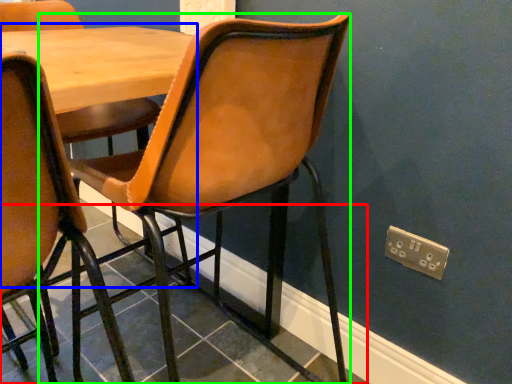
Question: Which object is positioned closest to tile (highlighted by a red box)? Select from table (highlighted by a blue box) and chair (highlighted by a green box).

Choices:
 (A) table
 (B) chair

Answer: (B)